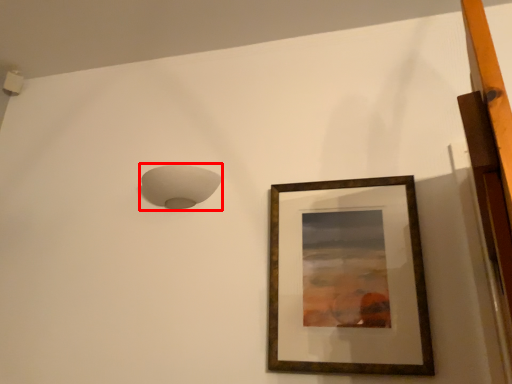
Question: From the image's perspective, considering the relative positions of lamp (annotated by the red box) and picture frame in the image provided, where is lamp (annotated by the red box) located with respect to the staircase?

Choices:
 (A) above
 (B) below

Answer: (A)